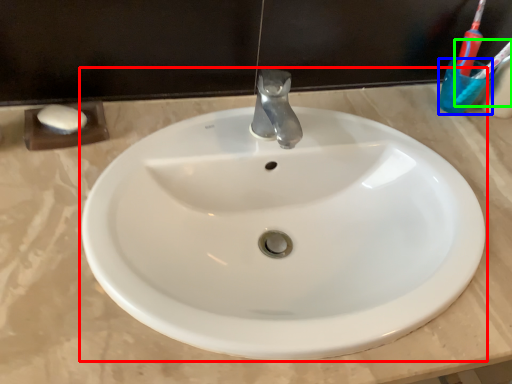
Question: Which is nearer to the sink (highlighted by a red box)? liquid (highlighted by a blue box) or toothbrush (highlighted by a green box).

Choices:
 (A) liquid
 (B) toothbrush

Answer: (A)